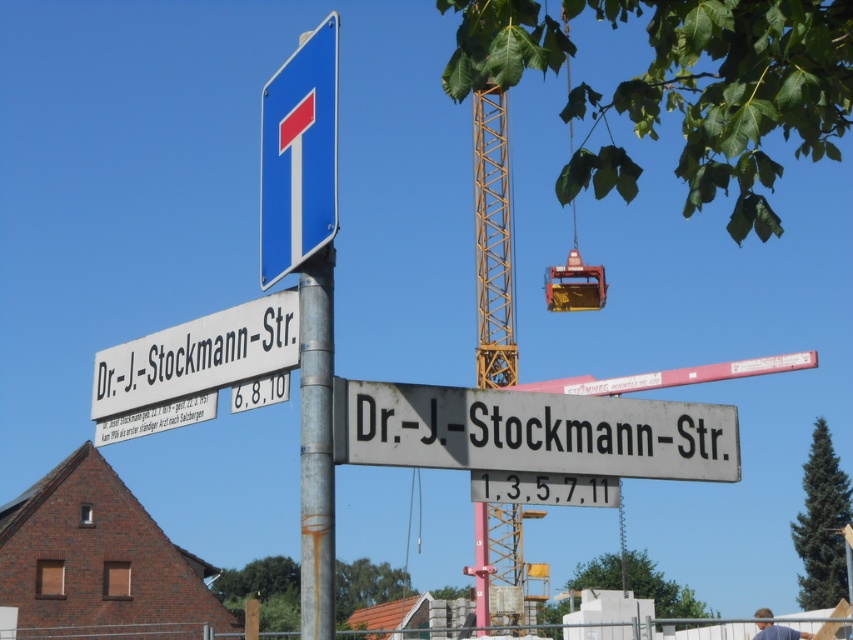
Is white matte street sign at center above white plastic street sign at upper left?

Actually, white matte street sign at center is below white plastic street sign at upper left.

Is point (532, 400) positioned before point (136, 381)?

That is True.

Locate an element on the screen. white matte street sign at center is located at coordinates (532, 432).

At what (x,y) coordinates should I click in order to perform the action: click on white matte street sign at center. Please return your answer as a coordinate pair (x, y). The width and height of the screenshot is (853, 640). Looking at the image, I should click on (532, 432).

Can you confirm if blue plastic sign at upper center is taller than white plastic street sign at upper left?

Yes, blue plastic sign at upper center is taller than white plastic street sign at upper left.

Who is more distant from viewer, (x=310, y=65) or (x=228, y=372)?

The point (x=228, y=372) is behind.

The width and height of the screenshot is (853, 640). I want to click on blue plastic sign at upper center, so click(299, 154).

Does blue plastic sign at upper center have a larger size compared to rusty metal pole at center?

Yes.

Who is more forward, (328, 173) or (328, 376)?

Point (328, 173) is in front.

The width and height of the screenshot is (853, 640). I want to click on blue plastic sign at upper center, so click(299, 154).